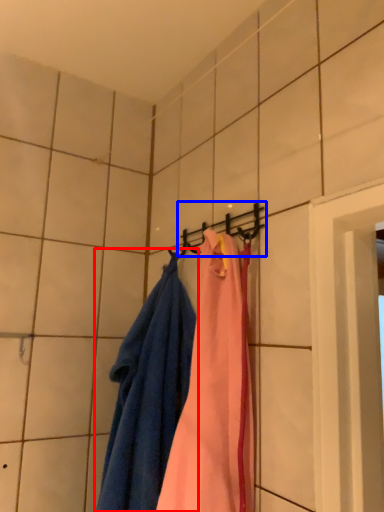
Question: Which point is closer to the camera, towel (highlighted by a red box) or hanger (highlighted by a blue box)?

Choices:
 (A) towel
 (B) hanger

Answer: (A)